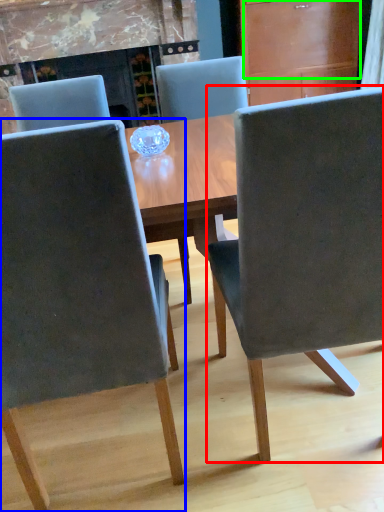
Question: Which object is the farthest from chair (highlighted by a red box)? Choose among these: chair (highlighted by a blue box) or drawer (highlighted by a green box).

Choices:
 (A) chair
 (B) drawer

Answer: (B)